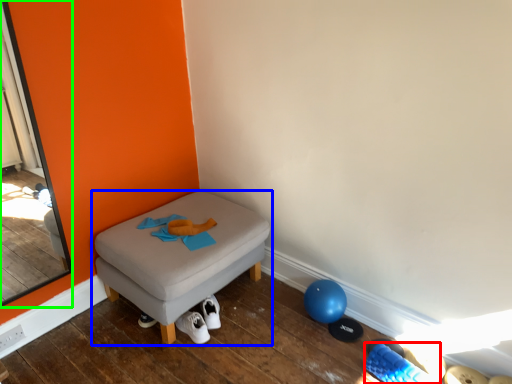
Question: Estimate the real-world distances between objects in this image. Which object is farther from footwear (highlighted by a red box), furniture (highlighted by a blue box) or screen door (highlighted by a green box)?

Choices:
 (A) furniture
 (B) screen door

Answer: (B)